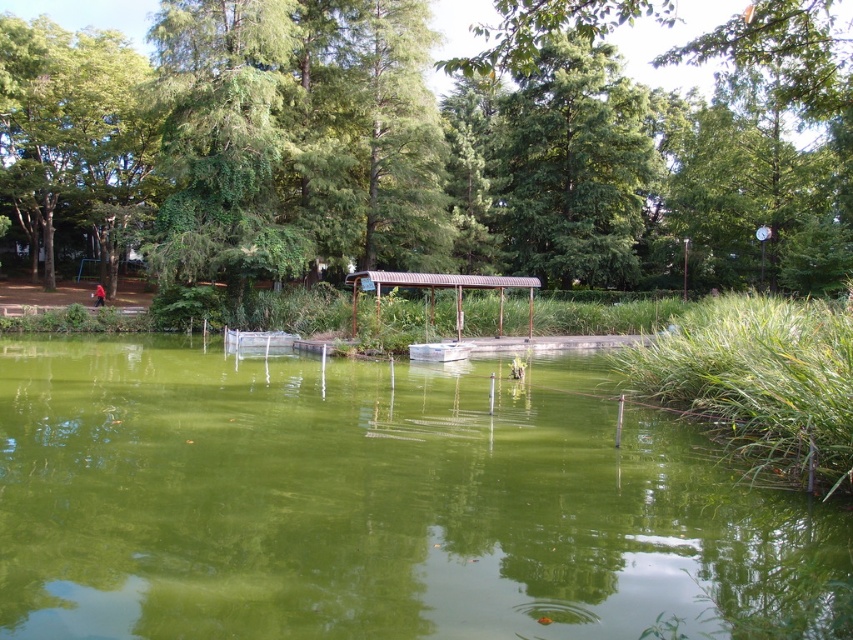
You are standing at the edge of the pond and want to reach the metallic gray boat at center. The green leafy tree at upper center is blocking your path. Can you walk around the tree to get to the boat?

The green leafy tree at upper center is 29.85 meters away from the metallic gray boat at center, so you can walk around the tree to reach the boat since the distance allows for a path around it.

Looking at this image, you are planning to take a photo of the green algae water at center and the green leafy tree at upper left. Which object would you need to frame more tightly in your camera to ensure it fits within the shot?

The green algae water at center occupies less space than the green leafy tree at upper left, so you would need to frame the green algae water at center more tightly to ensure it fits within the shot.

You are standing in the park looking at the pond. There is a green leafy tree at upper center. Where is the green leafy tree at upper center located in relation to the point marked at coordinates (573, 166)?

The green leafy tree at upper center is exactly at the point marked by the coordinates (573, 166).